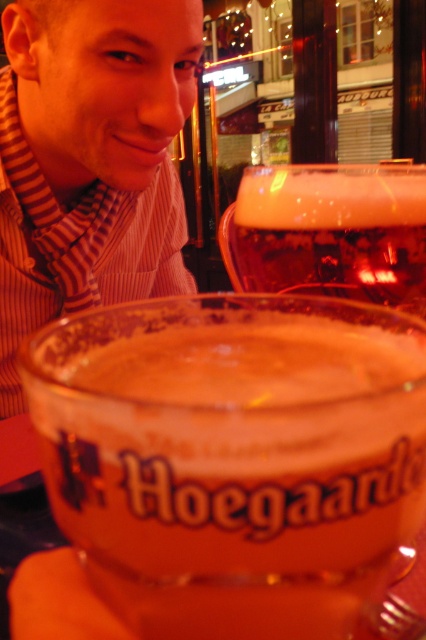
Question: Can you confirm if translucent glass hoegaarden beer at center is bigger than matte striped scarf at upper left?

Choices:
 (A) yes
 (B) no

Answer: (B)

Question: Which object is farther from the camera taking this photo?

Choices:
 (A) foamy amber glass at center
 (B) matte striped scarf at upper left

Answer: (B)

Question: Considering the real-world distances, which object is closest to the foamy amber glass at center?

Choices:
 (A) translucent glass hoegaarden beer at center
 (B) matte striped scarf at upper left

Answer: (A)

Question: Does matte striped scarf at upper left appear over foamy amber glass at center?

Choices:
 (A) yes
 (B) no

Answer: (A)

Question: Which point is farther to the camera?

Choices:
 (A) foamy amber glass at center
 (B) matte striped scarf at upper left
 (C) translucent glass hoegaarden beer at center

Answer: (B)

Question: Where is matte striped scarf at upper left located in relation to foamy amber glass at center in the image?

Choices:
 (A) below
 (B) above

Answer: (B)